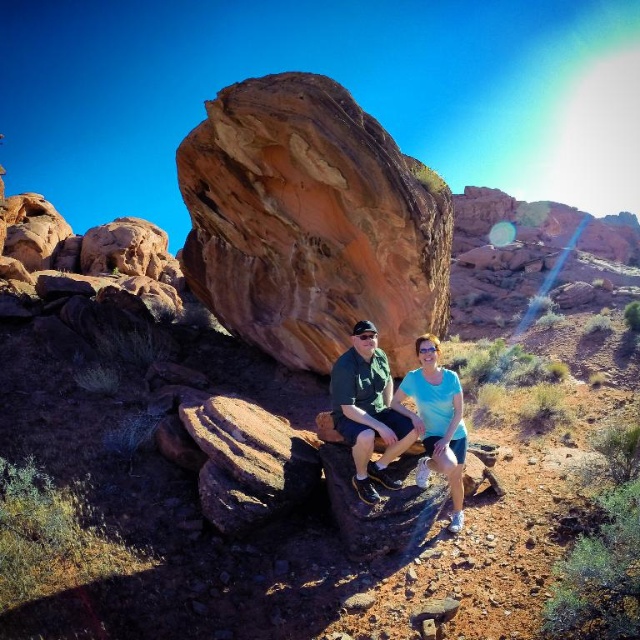
You are standing at point A located at coordinates point A at [337,145]. You want to walk to point B which is 9.18 meters away. Considering the desert environment described, what potential challenges might you face during your journey?

The potential challenges include the arid desert environment with sparse vegetation, which may lead to dehydration and lack of shade. The rocky terrain and sharp shadows suggest uneven ground, increasing the risk of tripping or slipping on the smooth, polished rock formations. Additionally, the bright sunlight and clear sky indicate intense heat, raising the risk of heat exhaustion or sunburn during the 9.18 meters journey.

You are a hiker standing at the base of the rustic sandstone rock at center. You want to place a 10 meter long rope from the bottom to the top of the rock. Is the rope long enough?

The distance of rustic sandstone rock at center from viewer is 11.24 meters, so the 10 meter long rope is not long enough to reach from the bottom to the top of the rustic sandstone rock at center.

You are a photographer planning to take a closeup shot of the matte green shorts at center. However, the rustic sandstone rock at center is blocking your view. Can you move the rock to get a clear shot of the shorts?

The rustic sandstone rock at center is positioned over matte green shorts at center, so you cannot move the rock without also moving the shorts since they are directly underneath it.